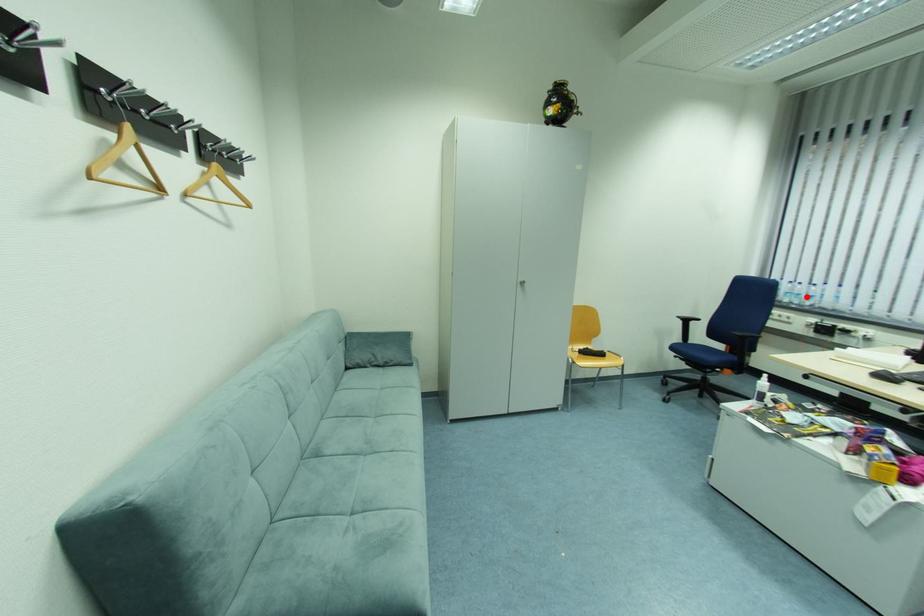
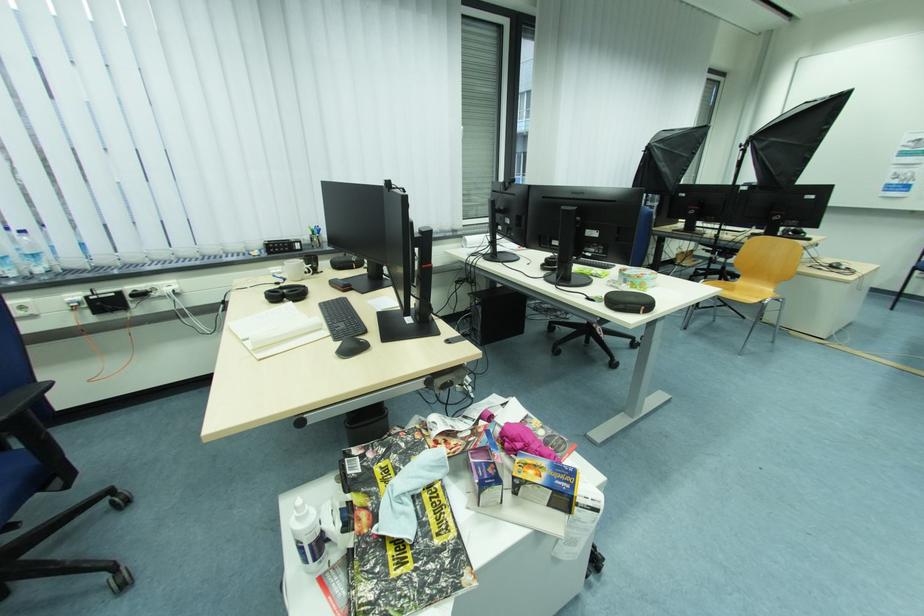
In the second image, find the point that corresponds to the highlighted location in the first image.

(18, 261)